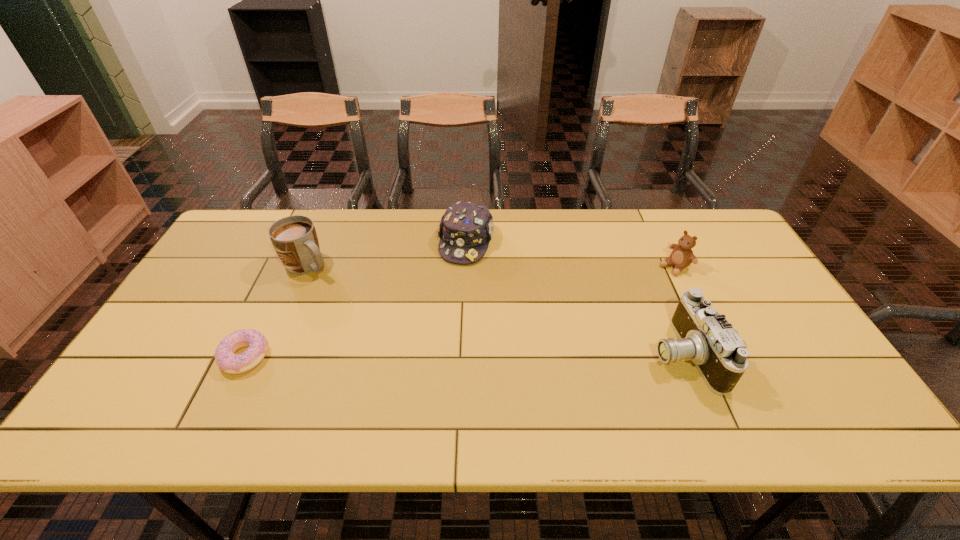
Where is `vacant spot on the desktop that is between the doughnut and the camera and is positioned on the front-facing side of the teddy bear`? vacant spot on the desktop that is between the doughnut and the camera and is positioned on the front-facing side of the teddy bear is located at coordinates (522, 355).

The height and width of the screenshot is (540, 960). Find the location of `free space on the desktop that is between the shortest object and the camera and is positioned on the side of the mug with the handle`. free space on the desktop that is between the shortest object and the camera and is positioned on the side of the mug with the handle is located at coordinates (435, 355).

The height and width of the screenshot is (540, 960). What are the coordinates of `free space on the desktop that is between the shortest object and the camera and is positioned on the front-facing side of the third object from right to left` in the screenshot? It's located at (430, 355).